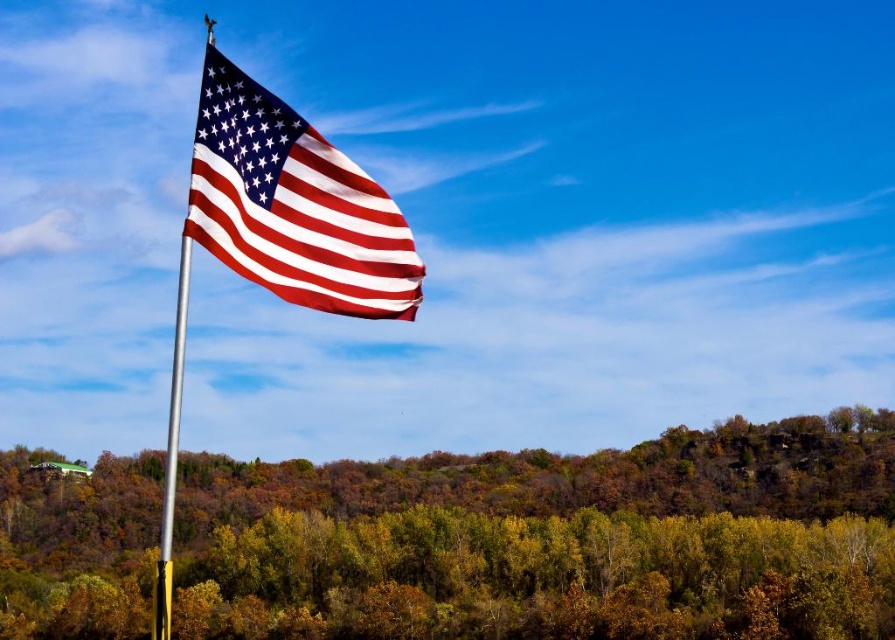
You are a bird flying over the scene and want to land on a spot. You see the green leafy tree at center and the matte fabric flag at upper left. Which one is closer to the ground?

The green leafy tree at center is located below the matte fabric flag at upper left, so it is closer to the ground.

You are standing in front of the silver metallic pole at left and want to walk towards the green leafy tree at center. Which direction should you move?

The green leafy tree at center is to the right of the silver metallic pole at left, so you should move to the right to reach it.